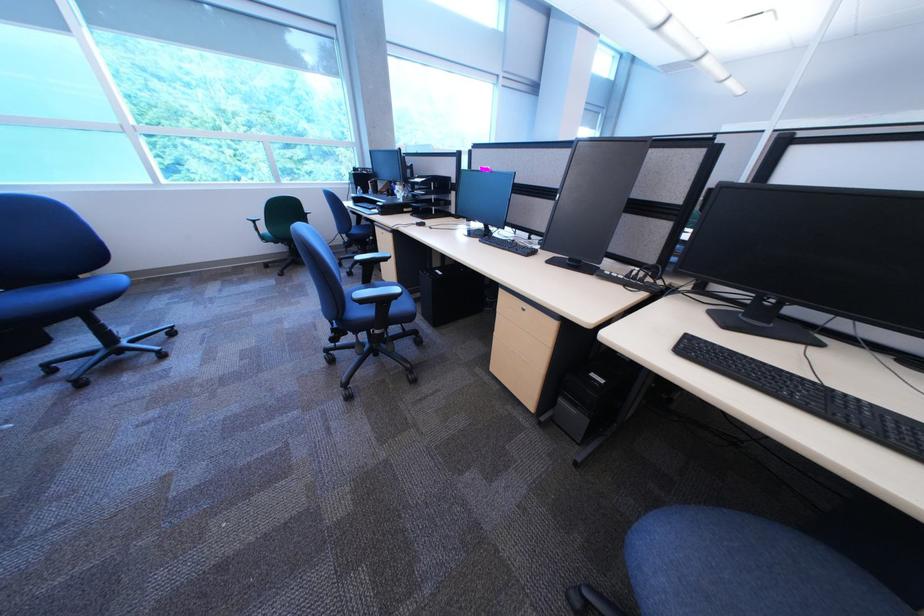
Locate an element on the screen. Image resolution: width=924 pixels, height=616 pixels. black paper tray is located at coordinates (438, 167).